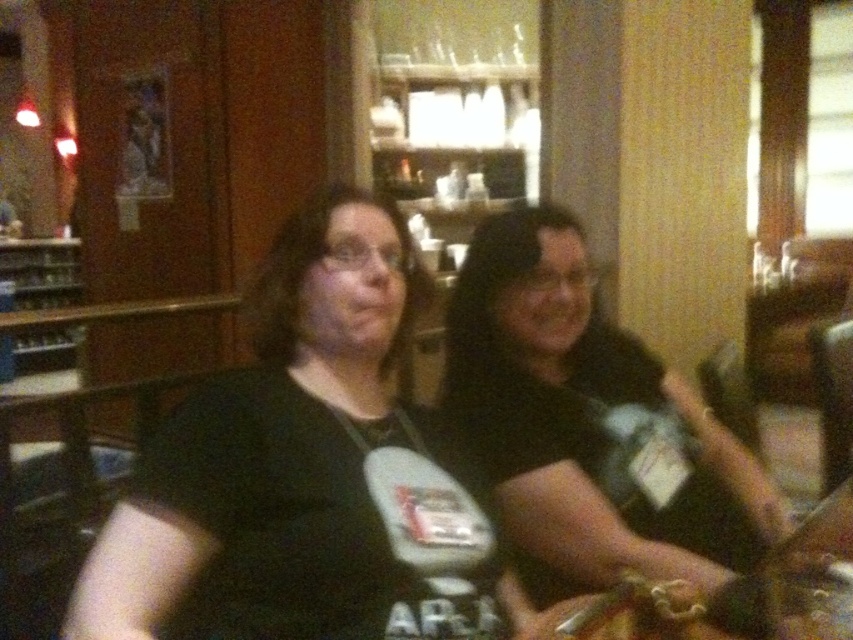
You are a photographer setting up a shot of the black matte shirt at center and the clear plastic bottle at center. The camera has a fixed focal length and you want both objects to be in focus. Which object should you focus on to ensure depth of field covers both?

You should focus on the black matte shirt at center because it is wider than the clear plastic bottle at center, so focusing on the wider object helps ensure both are in focus.

You are a photographer setting up a shot in this scene. You need to ensure that the black matte shirt at center and the clear plastic bottle at center are both visible in the frame. Given their relative heights, which object should you position closer to the camera to maintain both in focus?

The black matte shirt at center is taller than the clear plastic bottle at center. To keep both in focus, position the clear plastic bottle at center closer to the camera since it is shorter, allowing the taller black matte shirt at center to still be within the depth of field.